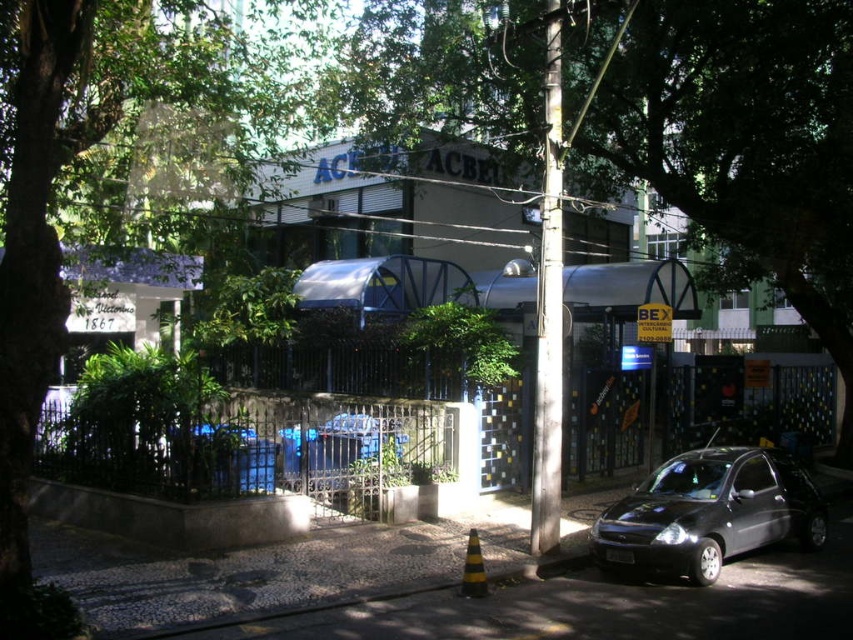
You are a delivery driver approaching the building with a large package. The green leafy tree at center and the matte black car at lower right are in your path. Which object is wider, requiring more space to navigate around?

The green leafy tree at center is wider than the matte black car at lower right, so you should navigate around the green leafy tree at center to allow sufficient space.

You are a delivery driver approaching the building with a large package. You see a green leafy tree at left and a matte black car at lower right. Which object is bigger and might block your view of the entrance?

The green leafy tree at left is larger than the matte black car at lower right, so it might block your view of the entrance.